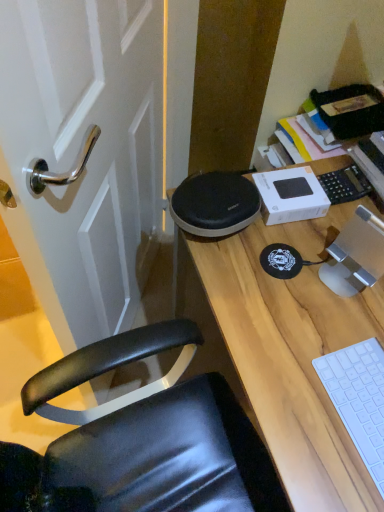
The height and width of the screenshot is (512, 384). What do you see at coordinates (359, 399) in the screenshot? I see `white plastic keyboard at lower right` at bounding box center [359, 399].

The width and height of the screenshot is (384, 512). Identify the location of white plastic keyboard at lower right. (359, 399).

Measure the distance between point (373, 380) and camera.

Point (373, 380) is 28.07 inches from camera.

Find the location of a particular element. This screenshot has width=384, height=512. wooden desk at center is located at coordinates (289, 351).

What do you see at coordinates (289, 351) in the screenshot? The width and height of the screenshot is (384, 512). I see `wooden desk at center` at bounding box center [289, 351].

The image size is (384, 512). Identify the location of white plastic keyboard at lower right. (359, 399).

Visually, is white plastic keyboard at lower right positioned to the left or to the right of wooden desk at center?

Clearly, white plastic keyboard at lower right is on the left of wooden desk at center in the image.

Which object is more forward, white plastic keyboard at lower right or wooden desk at center?

wooden desk at center is more forward.

Does point (382, 496) come farther from viewer compared to point (295, 464)?

No, (382, 496) is closer to viewer.

From the image's perspective, is white plastic keyboard at lower right above or below wooden desk at center?

From the image's perspective, white plastic keyboard at lower right appears above wooden desk at center.

From a real-world perspective, is white plastic keyboard at lower right positioned above or below wooden desk at center?

white plastic keyboard at lower right is situated higher than wooden desk at center in the real world.

Does white plastic keyboard at lower right have a lesser width compared to wooden desk at center?

Indeed, white plastic keyboard at lower right has a lesser width compared to wooden desk at center.

Is white plastic keyboard at lower right taller than wooden desk at center?

In fact, white plastic keyboard at lower right may be shorter than wooden desk at center.

In terms of size, does white plastic keyboard at lower right appear bigger or smaller than wooden desk at center?

In the image, white plastic keyboard at lower right appears to be smaller than wooden desk at center.

Is white plastic keyboard at lower right spatially inside wooden desk at center, or outside of it?

white plastic keyboard at lower right exists entirely within wooden desk at center.

Would you say white plastic keyboard at lower right is a long distance from wooden desk at center?

That's not correct — white plastic keyboard at lower right is a little close to wooden desk at center.

Is white plastic keyboard at lower right oriented towards wooden desk at center?

No, white plastic keyboard at lower right is not oriented towards wooden desk at center.

Consider the image. What's the angular difference between white plastic keyboard at lower right and wooden desk at center's facing directions?

They differ by 0.611 degrees in their facing directions.

How much distance is there between white plastic keyboard at lower right and wooden desk at center?

The distance of white plastic keyboard at lower right from wooden desk at center is 5.09 inches.

At what (x,y) coordinates should I click in order to perform the action: click on laptop keyboard positioned vertically above the wooden desk at center (from a real-world perspective). Please return your answer as a coordinate pair (x, y). The width and height of the screenshot is (384, 512). Looking at the image, I should click on (359, 399).

Which object is positioned more to the right, wooden desk at center or white plastic keyboard at lower right?

wooden desk at center.

Which object is further away from the camera taking this photo, wooden desk at center or white plastic keyboard at lower right?

white plastic keyboard at lower right.

Does point (180, 247) come behind point (381, 409)?

Yes, it is behind point (381, 409).

From the image's perspective, is wooden desk at center below white plastic keyboard at lower right?

Yes.

From a real-world perspective, does wooden desk at center stand above white plastic keyboard at lower right?

No, from a real-world perspective, wooden desk at center is not on top of white plastic keyboard at lower right.

Is wooden desk at center wider than white plastic keyboard at lower right?

Yes, wooden desk at center is wider than white plastic keyboard at lower right.

Which of these two, wooden desk at center or white plastic keyboard at lower right, stands taller?

wooden desk at center.

Can you confirm if wooden desk at center is bigger than white plastic keyboard at lower right?

Yes.

Is wooden desk at center positioned beyond the bounds of white plastic keyboard at lower right?

Indeed, wooden desk at center is completely outside white plastic keyboard at lower right.

From the picture: Is there a large distance between wooden desk at center and white plastic keyboard at lower right?

No.

Is wooden desk at center facing away from white plastic keyboard at lower right?

No, wooden desk at center is not facing the opposite direction of white plastic keyboard at lower right.

How many degrees apart are the facing directions of wooden desk at center and white plastic keyboard at lower right?

There is a 0.611-degree angle between the facing directions of wooden desk at center and white plastic keyboard at lower right.

This screenshot has width=384, height=512. Identify the location of desk located below the white plastic keyboard at lower right (from the image's perspective). (289, 351).

I want to click on desk on the right of white plastic keyboard at lower right, so point(289,351).

This screenshot has height=512, width=384. I want to click on laptop keyboard that appears on the left of wooden desk at center, so click(359, 399).